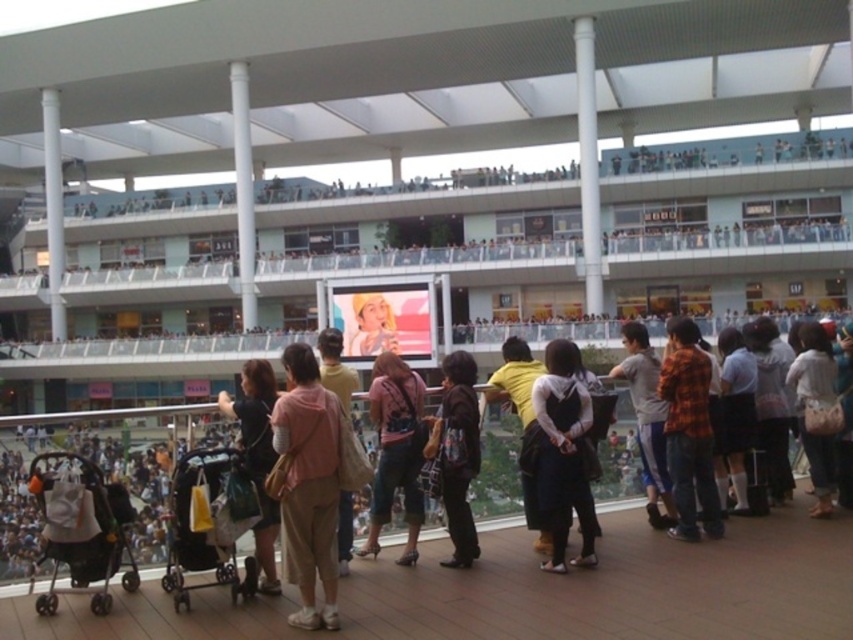
Which of these two, flannel shirt at center or light blue denim jeans at lower right, stands shorter?

light blue denim jeans at lower right is shorter.

Does flannel shirt at center appear on the left side of light blue denim jeans at lower right?

Yes, flannel shirt at center is to the left of light blue denim jeans at lower right.

Does point (680, 380) come in front of point (820, 355)?

Yes, it is.

This screenshot has height=640, width=853. Identify the location of flannel shirt at center. (688, 433).

Can you confirm if pink fabric jacket at center is positioned to the left of gray fabric pants at center?

Yes, pink fabric jacket at center is to the left of gray fabric pants at center.

The width and height of the screenshot is (853, 640). What do you see at coordinates (309, 483) in the screenshot?
I see `pink fabric jacket at center` at bounding box center [309, 483].

This screenshot has width=853, height=640. What do you see at coordinates (309, 483) in the screenshot?
I see `pink fabric jacket at center` at bounding box center [309, 483].

Find the location of a particular element. The height and width of the screenshot is (640, 853). pink fabric jacket at center is located at coordinates (309, 483).

Between point (55, 564) and point (242, 589), which one is positioned in front?

Point (55, 564) is in front.

What do you see at coordinates (80, 529) in the screenshot? I see `black fabric baby carriage at lower left` at bounding box center [80, 529].

Find the location of a particular element. Image resolution: width=853 pixels, height=640 pixels. black fabric baby carriage at lower left is located at coordinates (80, 529).